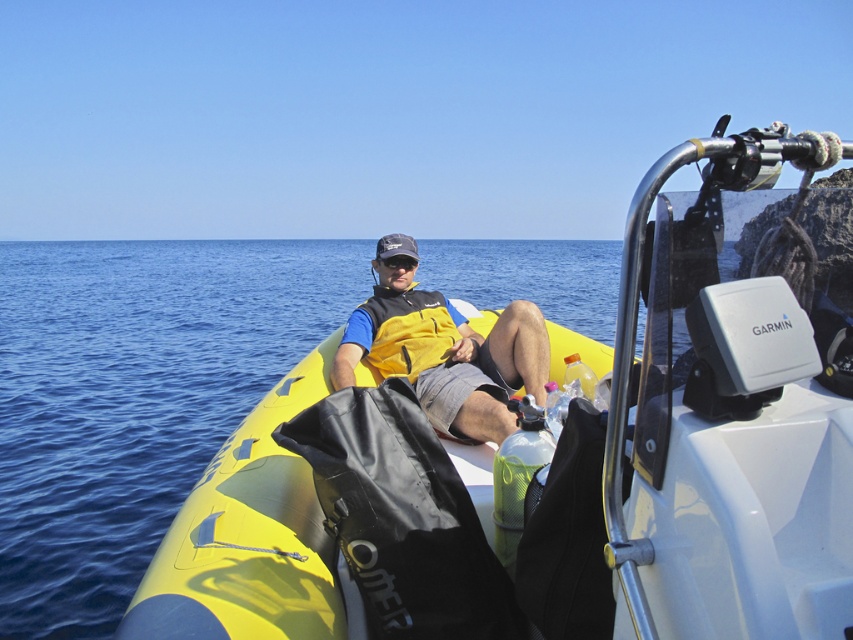
Is yellow matte life vest at center bigger than black matte goggles at center?

Indeed, yellow matte life vest at center has a larger size compared to black matte goggles at center.

Find the location of `yellow matte life vest at center`. yellow matte life vest at center is located at coordinates (445, 352).

Can you confirm if yellow rubber boat at center is shorter than yellow fleece life jacket at center?

In fact, yellow rubber boat at center may be taller than yellow fleece life jacket at center.

Can you confirm if yellow rubber boat at center is positioned above yellow fleece life jacket at center?

Incorrect, yellow rubber boat at center is not positioned above yellow fleece life jacket at center.

At what (x,y) coordinates should I click in order to perform the action: click on yellow rubber boat at center. Please return your answer as a coordinate pair (x, y). Looking at the image, I should click on (556, 470).

Does yellow matte life vest at center lie behind yellow fleece life jacket at center?

No, it is in front of yellow fleece life jacket at center.

Describe the element at coordinates (445, 352) in the screenshot. The width and height of the screenshot is (853, 640). I see `yellow matte life vest at center` at that location.

Is point (386, 305) positioned after point (440, 308)?

No, it is in front of (440, 308).

I want to click on yellow matte life vest at center, so click(445, 352).